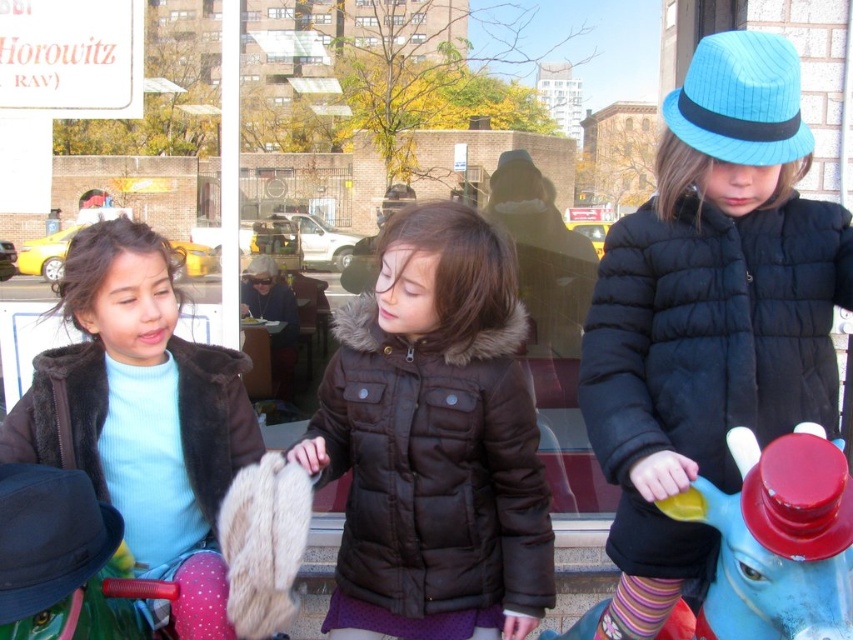
Question: Does brown quilted jacket at center lie behind light blue fleece jacket at left?

Choices:
 (A) yes
 (B) no

Answer: (A)

Question: Can you confirm if black puffy jacket at center is positioned below blue plastic horse at right?

Choices:
 (A) no
 (B) yes

Answer: (A)

Question: Among these points, which one is nearest to the camera?

Choices:
 (A) (194, 488)
 (B) (798, 394)
 (C) (421, 554)
 (D) (741, 609)

Answer: (D)

Question: Which point is closer to the camera?

Choices:
 (A) (590, 621)
 (B) (473, 588)
 (C) (90, 445)
 (D) (810, 324)

Answer: (D)

Question: Does black puffy jacket at center have a smaller size compared to light blue fleece jacket at left?

Choices:
 (A) no
 (B) yes

Answer: (A)

Question: Which point is farther to the camera?

Choices:
 (A) (200, 452)
 (B) (525, 396)
 (C) (784, 256)

Answer: (A)